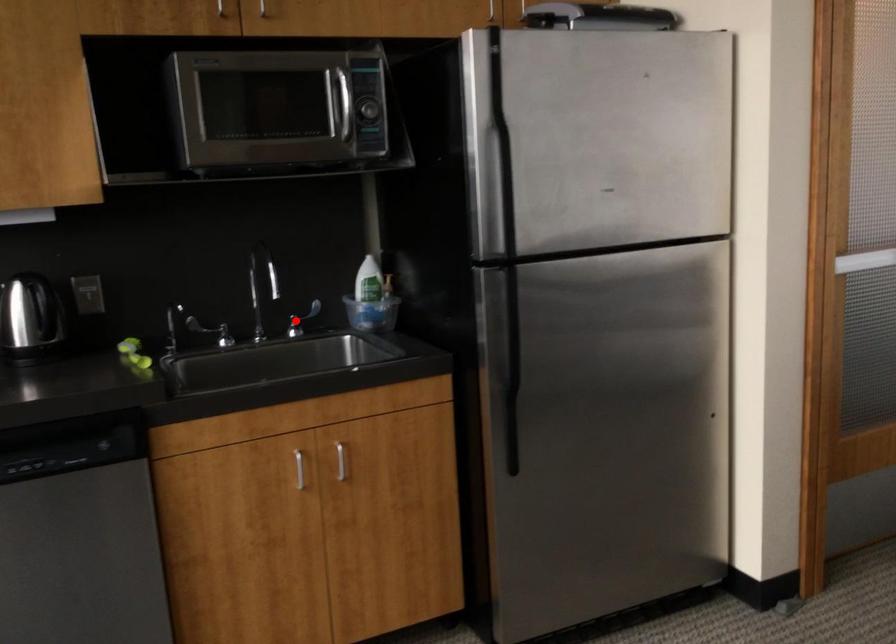
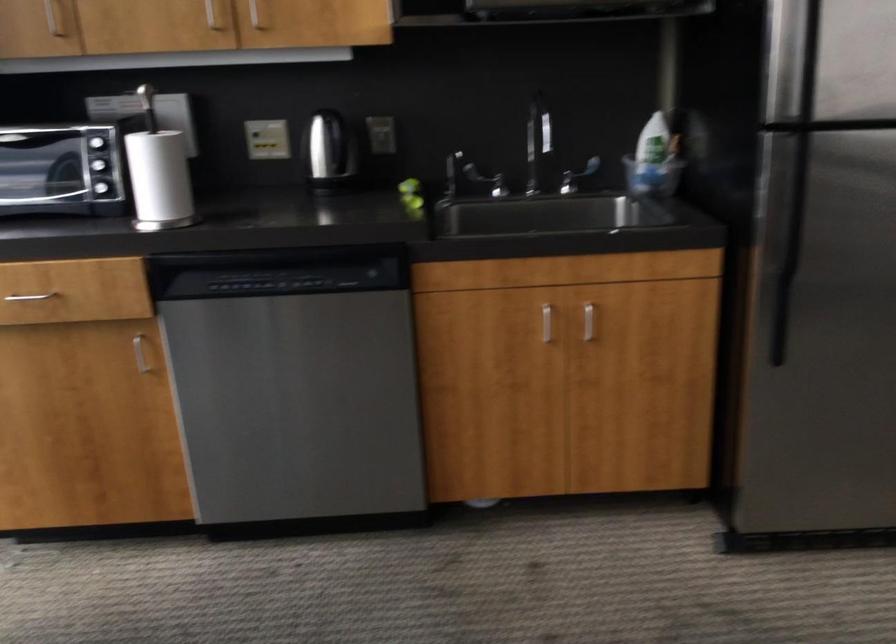
In the second image, find the point that corresponds to the highlighted location in the first image.

(576, 176)